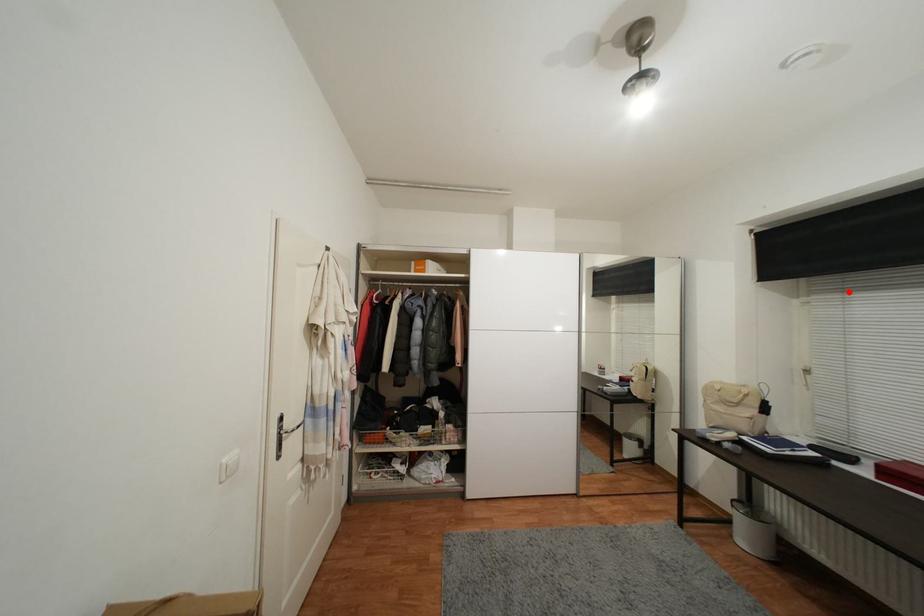
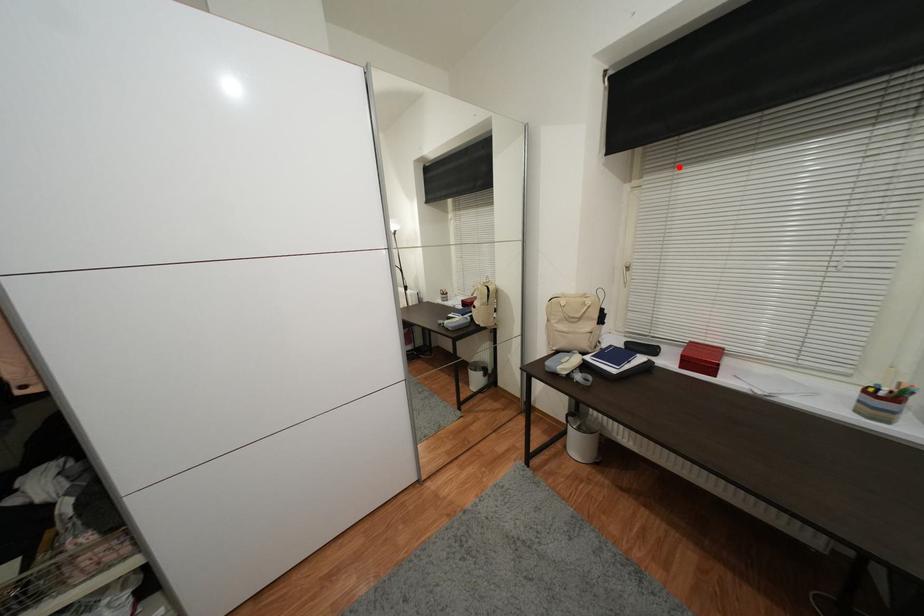
In the scene shown: I am providing you with two images of the same scene from different viewpoints. A red point is marked on the first image and another point is marked on the second image. Is the marked point in image1 the same physical position as the marked point in image2?

Yes